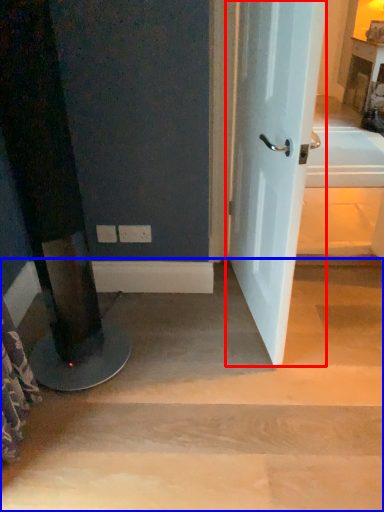
Question: Which of the following is the closest to the observer, door (highlighted by a red box) or stairwell (highlighted by a blue box)?

Choices:
 (A) door
 (B) stairwell

Answer: (A)